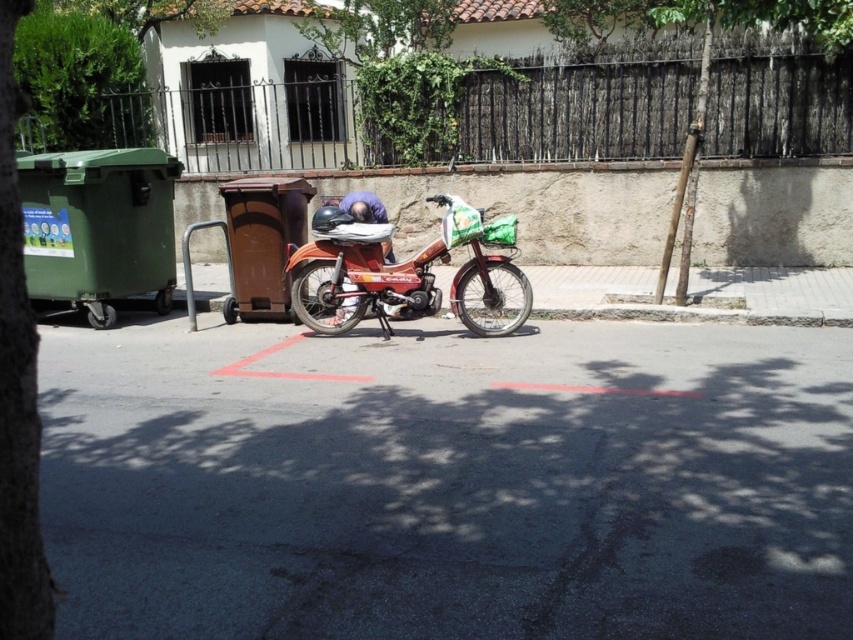
Question: Which point is farther from the camera taking this photo?

Choices:
 (A) (363, 61)
 (B) (677, 280)
 (C) (6, 616)

Answer: (A)

Question: Which object is the farthest from the green leafy tree at left?

Choices:
 (A) brown rough wooden pole at right
 (B) green leafy tree at upper center

Answer: (B)

Question: Does matte orange motorcycle at center appear under green leafy tree at upper center?

Choices:
 (A) no
 (B) yes

Answer: (B)

Question: Among these points, which one is nearest to the camera?

Choices:
 (A) (9, 468)
 (B) (289, 291)

Answer: (A)

Question: In this image, where is green leafy tree at upper center located relative to brown rough wooden pole at right?

Choices:
 (A) below
 (B) above

Answer: (B)

Question: Does green leafy tree at left appear on the left side of brown rough wooden pole at right?

Choices:
 (A) yes
 (B) no

Answer: (A)